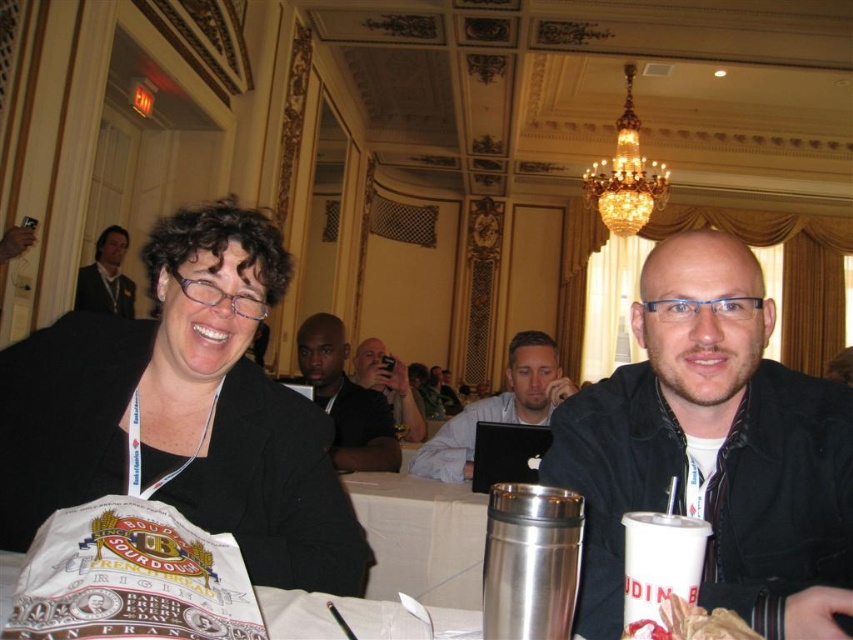
Question: Does matte black laptop at center come behind black matte camera at center?

Choices:
 (A) no
 (B) yes

Answer: (A)

Question: Which object is the farthest from the matte black suit at upper left?

Choices:
 (A) white paper cup at lower right
 (B) black matte jacket at right
 (C) dark skin bald man at center
 (D) golden crispy chicken at lower right

Answer: (D)

Question: Which point is farther from the camera taking this photo?

Choices:
 (A) (260, 493)
 (B) (717, 620)
 (C) (677, 349)
 (D) (316, 401)

Answer: (D)

Question: Can you confirm if black matte jacket at right is positioned above white paper cup at lower right?

Choices:
 (A) yes
 (B) no

Answer: (A)

Question: Considering the relative positions of matte black jacket at center and golden crispy chicken at lower right in the image provided, where is matte black jacket at center located with respect to golden crispy chicken at lower right?

Choices:
 (A) above
 (B) below

Answer: (A)

Question: Which of the following is the closest to the observer?

Choices:
 (A) silver metallic thermos at right
 (B) matte black jacket at center
 (C) dark skin bald man at center

Answer: (A)